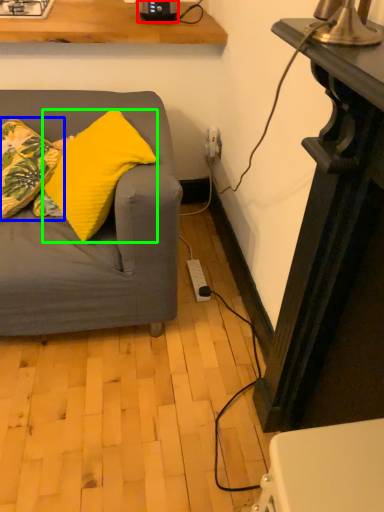
Question: Which object is positioned closest to appliance (highlighted by a red box)? Select from pillow (highlighted by a blue box) and pillow (highlighted by a green box).

Choices:
 (A) pillow
 (B) pillow

Answer: (A)